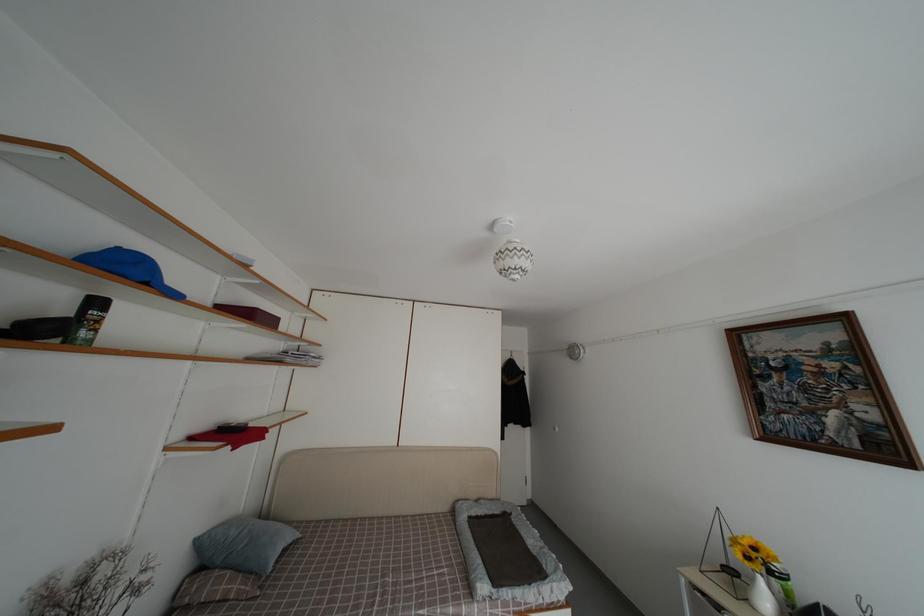
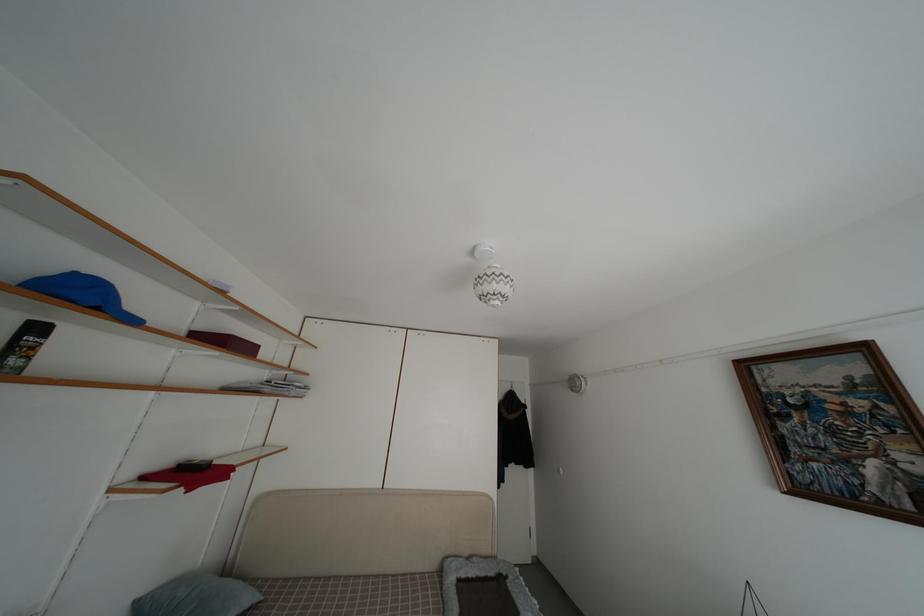
Question: How did the camera likely rotate?

Choices:
 (A) Left
 (B) Right
 (C) Up
 (D) Down

Answer: (C)